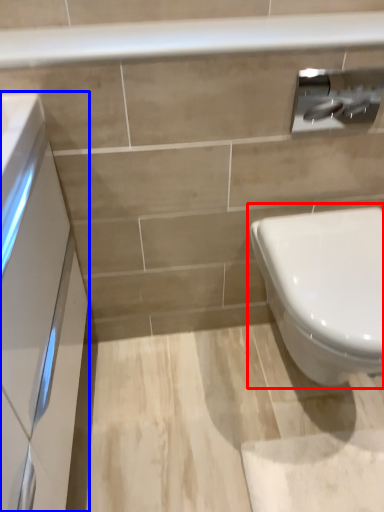
Question: Which point is further to the camera, toilet (highlighted by a red box) or porcelain (highlighted by a blue box)?

Choices:
 (A) toilet
 (B) porcelain

Answer: (A)